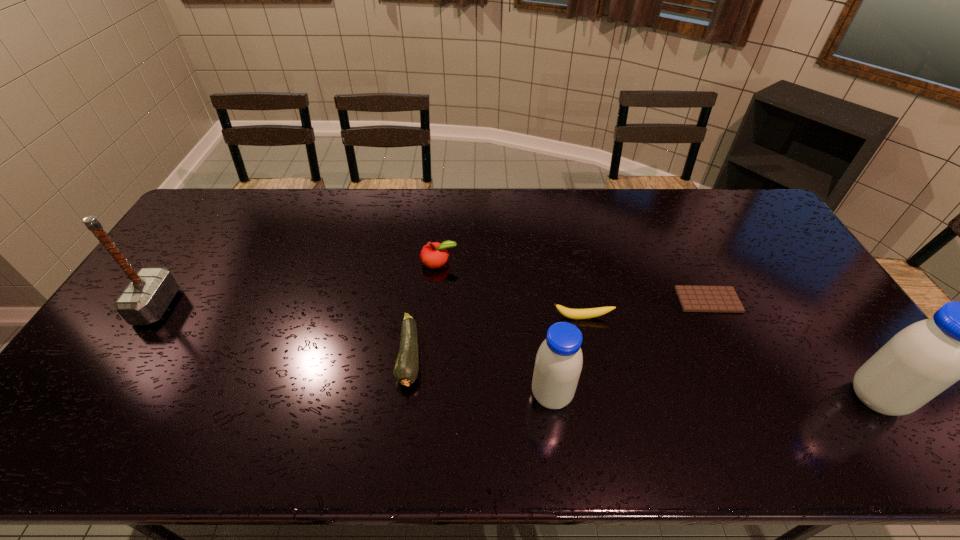
At what (x,y) coordinates should I click in order to perform the action: click on empty location between the rightmost object and the hammer. Please return your answer as a coordinate pair (x, y). The image size is (960, 540). Looking at the image, I should click on (516, 352).

Locate an element on the screen. The width and height of the screenshot is (960, 540). unoccupied position between the rightmost object and the leftmost object is located at coordinates (516, 352).

Where is `vacant space that's between the banana and the rightmost object`? This screenshot has width=960, height=540. vacant space that's between the banana and the rightmost object is located at coordinates (729, 357).

Find the location of `the second closest object to the apple`. the second closest object to the apple is located at coordinates (567, 312).

I want to click on object identified as the sixth closest to the zucchini, so click(x=921, y=361).

At what (x,y) coordinates should I click in order to perform the action: click on vacant position in the image that satisfies the following two spatial constraints: 1. on the striking surface of the shorter soya milk; 2. on the right side of the leftmost object. Please return your answer as a coordinate pair (x, y). This screenshot has width=960, height=540. Looking at the image, I should click on (98, 395).